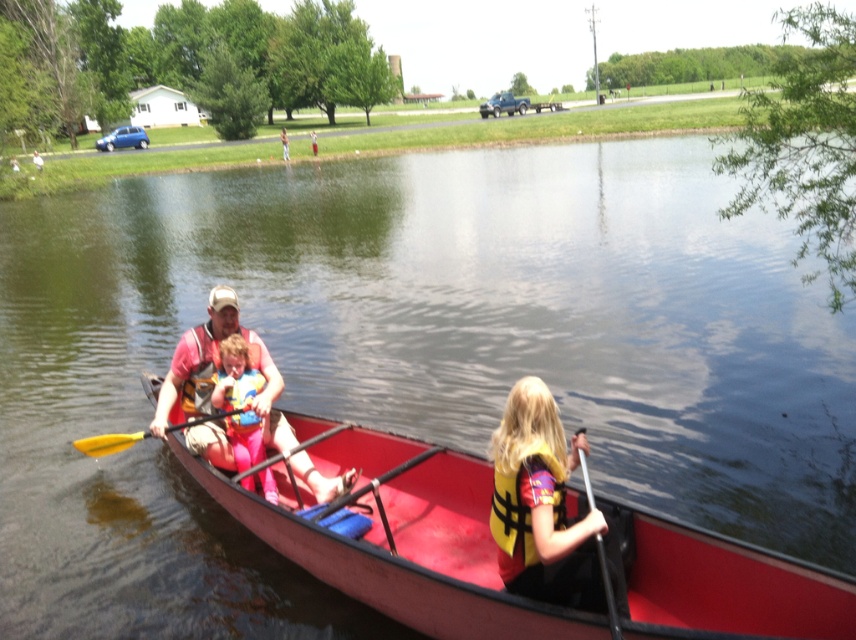
Can you confirm if yellow life vest at center is wider than matte pink life vest at center?

No.

Between point (619, 609) and point (259, 397), which one is positioned in front?

Point (619, 609) is more forward.

Which is behind, point (533, 595) or point (214, 358)?

The point (214, 358) is behind.

At what (x,y) coordinates should I click in order to perform the action: click on yellow life vest at center. Please return your answer as a coordinate pair (x, y). This screenshot has height=640, width=856. Looking at the image, I should click on [x=541, y=504].

Can you confirm if matte pink life vest at center is positioned below orange life jacket at center?

Indeed, matte pink life vest at center is positioned under orange life jacket at center.

At what (x,y) coordinates should I click in order to perform the action: click on matte pink life vest at center. Please return your answer as a coordinate pair (x, y). The height and width of the screenshot is (640, 856). Looking at the image, I should click on (218, 368).

Based on the photo, does yellow life vest at center appear on the left side of yellow wood paddle at left?

In fact, yellow life vest at center is to the right of yellow wood paddle at left.

Who is taller, yellow life vest at center or yellow wood paddle at left?

yellow life vest at center

Identify the location of yellow life vest at center. pyautogui.click(x=541, y=504).